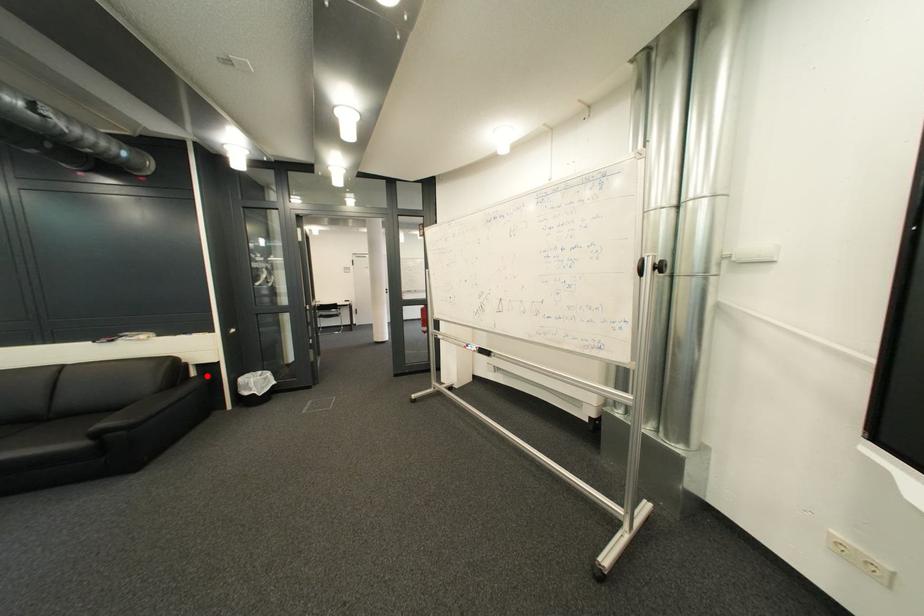
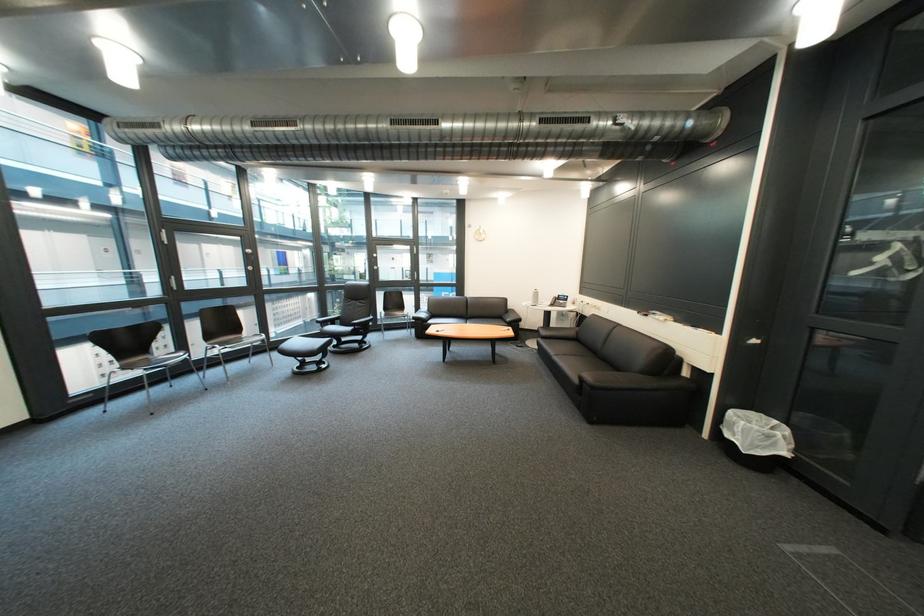
Question: I am providing you with two images of the same scene from different viewpoints. Image1 has a red point marked. In image2, the corresponding 3D location appears at what relative position? Reply with the corresponding letter.

Choices:
 (A) Closer
 (B) Farther

Answer: (A)